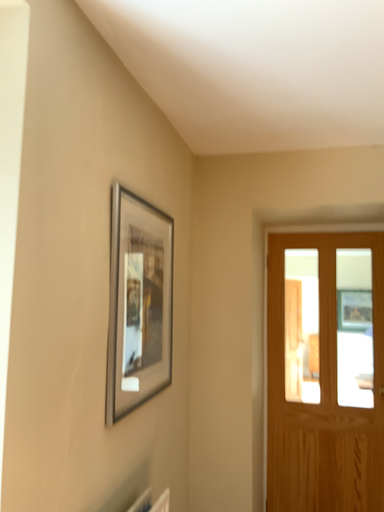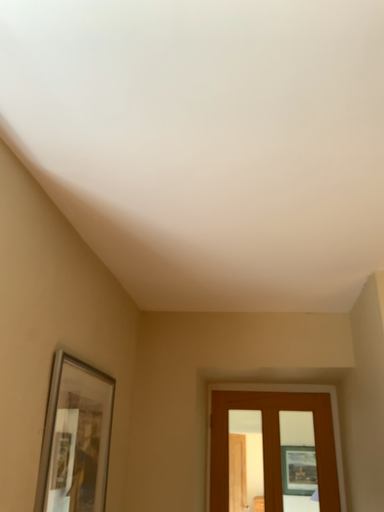
Question: How did the camera likely rotate when shooting the video?

Choices:
 (A) rotated right
 (B) rotated left

Answer: (A)